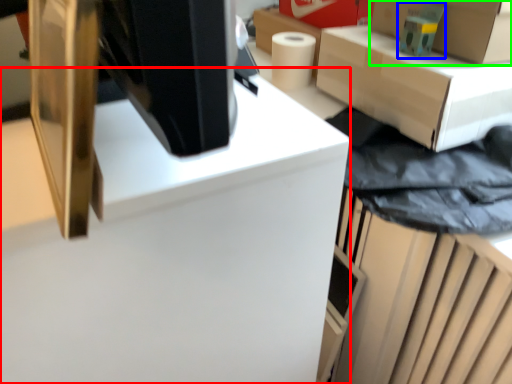
Question: Considering the real-world distances, which object is closest to computer desk (highlighted by a red box)? toy (highlighted by a blue box) or box (highlighted by a green box).

Choices:
 (A) toy
 (B) box

Answer: (A)